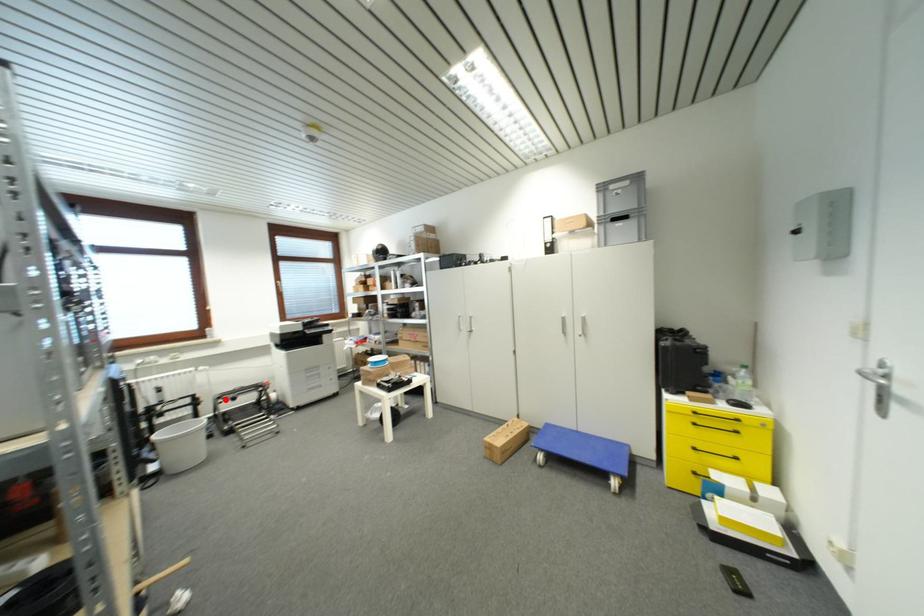
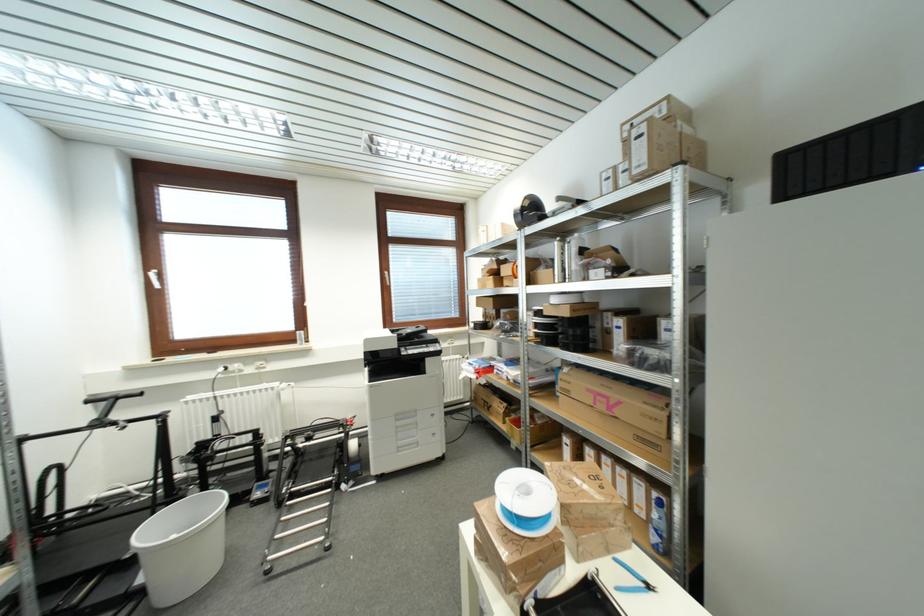
Locate, in the second image, the point that corresponds to the highlighted location in the first image.

(297, 438)